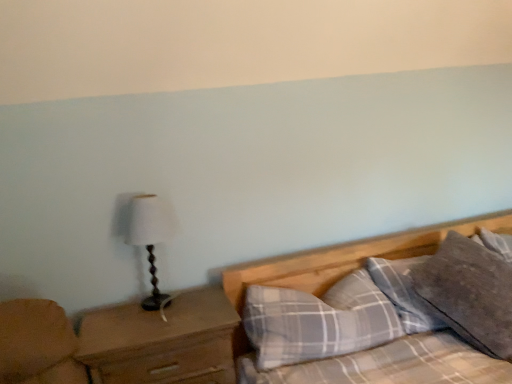
Where is `vacant area on top of wooden table lamp at left (from a real-world perspective)`? This screenshot has height=384, width=512. vacant area on top of wooden table lamp at left (from a real-world perspective) is located at coordinates (138, 204).